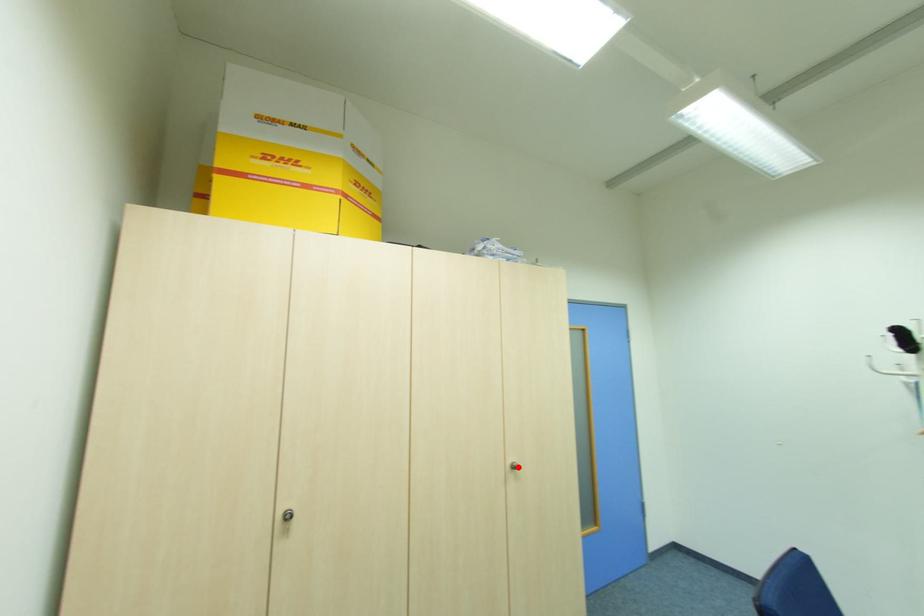
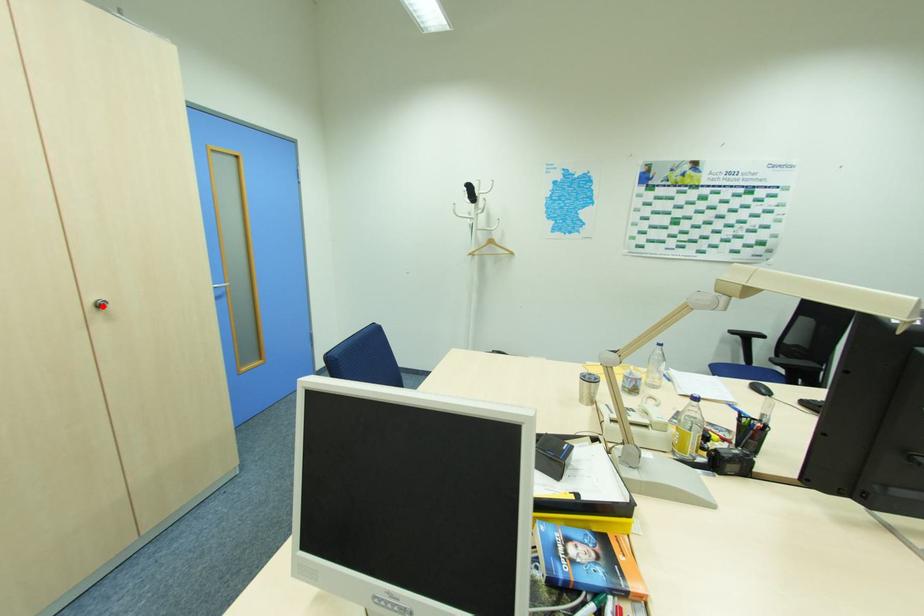
I am providing you with two images of the same scene from different viewpoints. A red point is marked on the first image and another point is marked on the second image. Are the points marked in image1 and image2 representing the same 3D position?

Yes